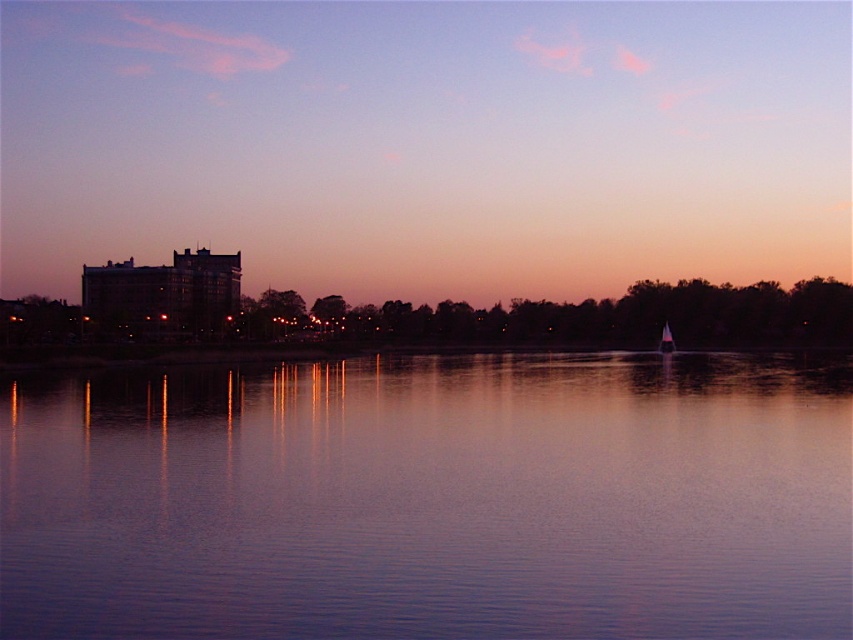
Is purple reflective water at center positioned in front of white glossy sailboat at center?

Yes, it is.

Where is `purple reflective water at center`? purple reflective water at center is located at coordinates (432, 499).

Locate an element on the screen. This screenshot has height=640, width=853. purple reflective water at center is located at coordinates (432, 499).

How far apart are purple glass building at upper left and purple reflective water at center?

purple glass building at upper left and purple reflective water at center are 257.56 meters apart.

Is purple glass building at upper left taller than purple reflective water at center?

Indeed, purple glass building at upper left has a greater height compared to purple reflective water at center.

Where is `purple glass building at upper left`? purple glass building at upper left is located at coordinates (427, 144).

Locate an element on the screen. The image size is (853, 640). purple glass building at upper left is located at coordinates (427, 144).

Where is `purple glass building at upper left`? The width and height of the screenshot is (853, 640). purple glass building at upper left is located at coordinates (427, 144).

Between point (647, 141) and point (668, 352), which one is positioned behind?

Positioned behind is point (647, 141).

This screenshot has width=853, height=640. What do you see at coordinates (427, 144) in the screenshot?
I see `purple glass building at upper left` at bounding box center [427, 144].

At what (x,y) coordinates should I click in order to perform the action: click on purple glass building at upper left. Please return your answer as a coordinate pair (x, y). Looking at the image, I should click on (427, 144).